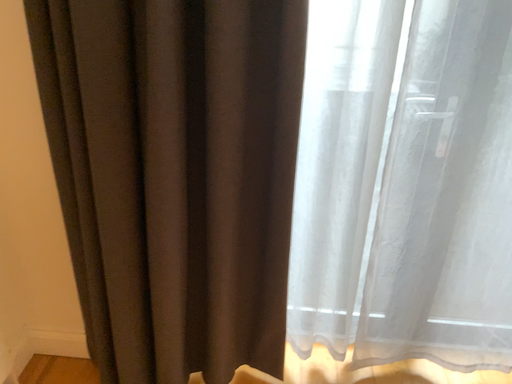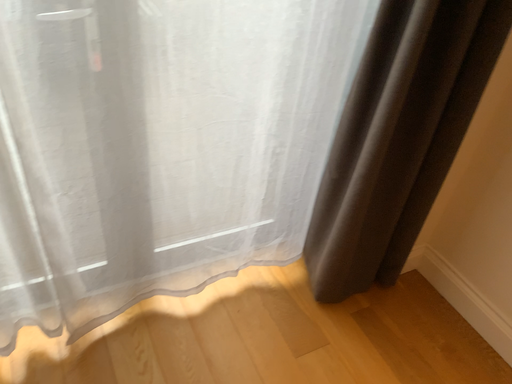
Question: How did the camera likely rotate when shooting the video?

Choices:
 (A) rotated upward
 (B) rotated downward

Answer: (B)